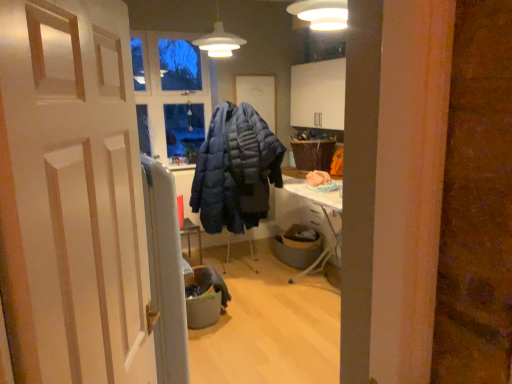
You are a GUI agent. You are given a task and a screenshot of the screen. Output one action in this format:
    pyautogui.click(x=<x>, y=<y>)
    Task: Click on the vacant area that is in front of gray fabric trash bin at center, which is the first trash bin/can in front-to-back order
    
    Given the screenshot: What is the action you would take?
    pyautogui.click(x=221, y=337)